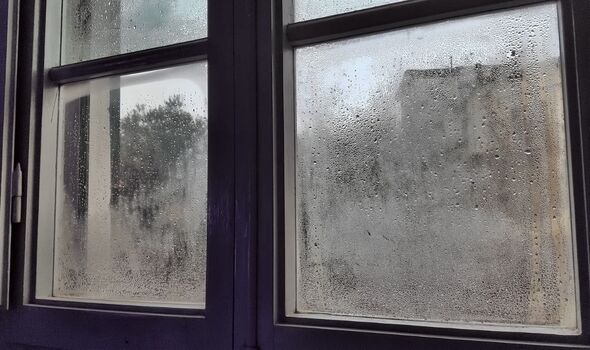
Locate an element on the screen. the bottom right window is located at coordinates (378, 180).